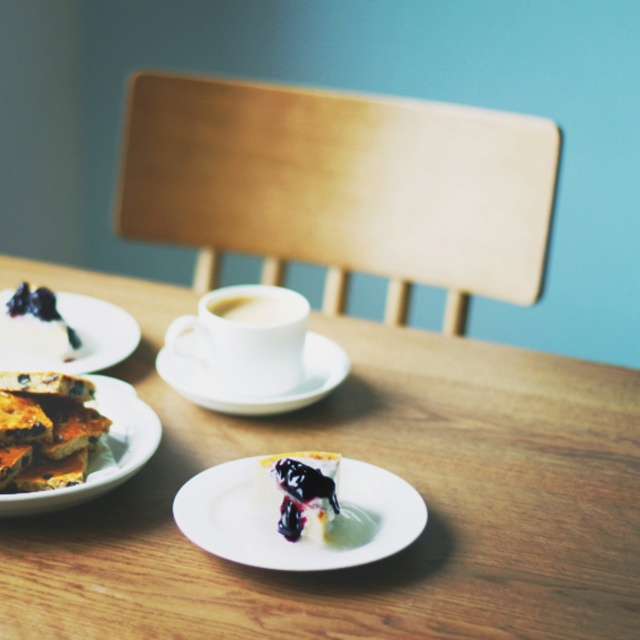
The width and height of the screenshot is (640, 640). What are the coordinates of `white matte plate at lower left` in the screenshot? It's located at (67, 337).

Between white matte plate at lower left and blueberry pie at lower left, which one is positioned higher?

white matte plate at lower left

Does point (124, 349) come farther from viewer compared to point (17, 323)?

Yes, it is behind point (17, 323).

Image resolution: width=640 pixels, height=640 pixels. Find the location of `white matte plate at lower left`. white matte plate at lower left is located at coordinates point(67,337).

Can you confirm if semi-glossy white cake with blueberry topping at lower center is positioned above white glossy cup at center?

Actually, semi-glossy white cake with blueberry topping at lower center is below white glossy cup at center.

Which is in front, point (326, 506) or point (284, 300)?

Point (326, 506)

Does point (321, 497) come in front of point (230, 317)?

Yes, it is in front of point (230, 317).

Where is `semi-glossy white cake with blueberry topping at lower center`? This screenshot has height=640, width=640. semi-glossy white cake with blueberry topping at lower center is located at coordinates (300, 492).

Can you confirm if white ceramic cup at center is bigger than matte brown plate at lower left?

Correct, white ceramic cup at center is larger in size than matte brown plate at lower left.

Can you confirm if white ceramic cup at center is shorter than matte brown plate at lower left?

No.

Between point (284, 392) and point (138, 424), which one is positioned behind?

Point (284, 392)

Identify the location of white ceramic cup at center. (248, 337).